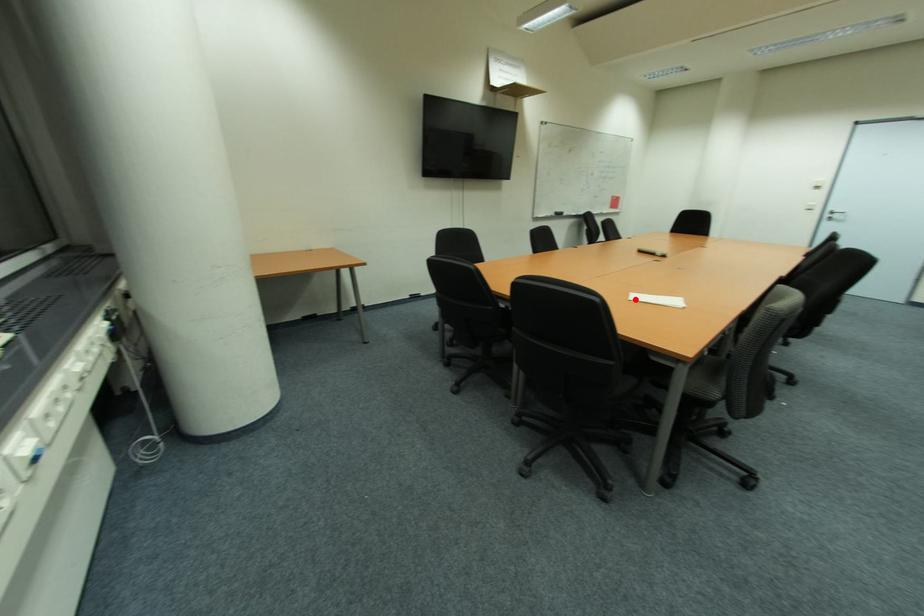
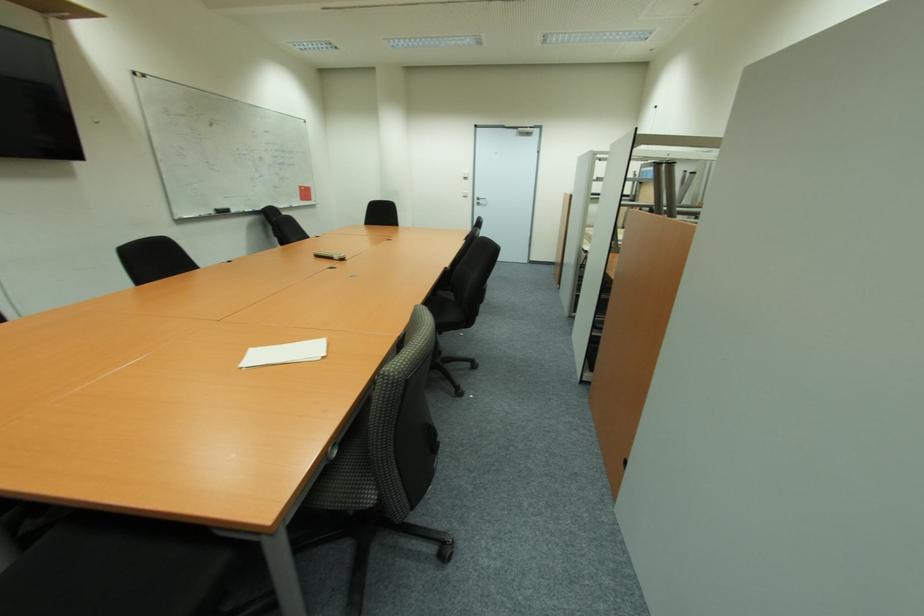
The point at the highlighted location is marked in the first image. Where is the corresponding point in the second image?

(244, 367)